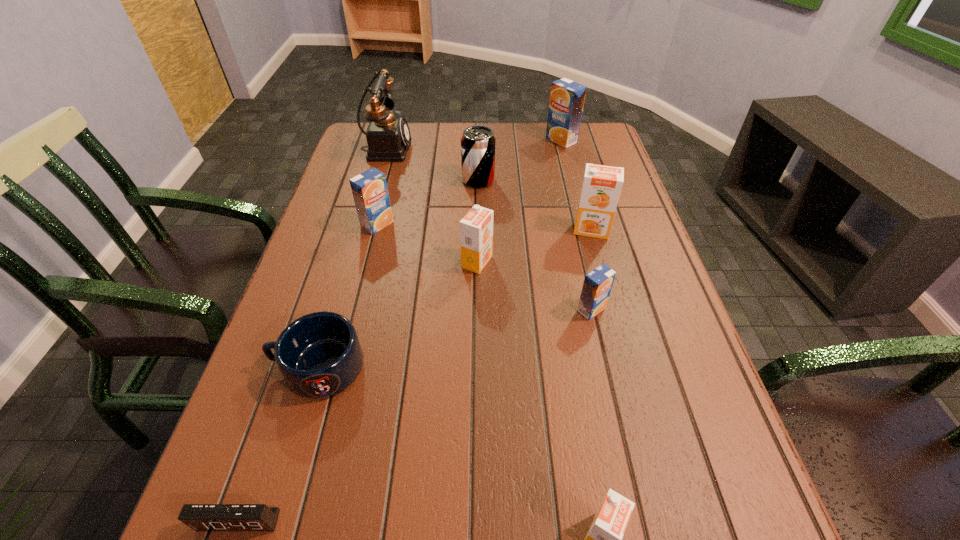
This screenshot has width=960, height=540. Find the location of `object present at the far right corner`. object present at the far right corner is located at coordinates (567, 97).

Where is `free space at the far edge of the desktop`? The width and height of the screenshot is (960, 540). free space at the far edge of the desktop is located at coordinates (540, 150).

You are a GUI agent. You are given a task and a screenshot of the screen. Output one action in this format:
    pyautogui.click(x=<x>, y=<y>)
    Task: Click on the vacant space at the left edge
    This screenshot has width=960, height=540.
    Given the screenshot: What is the action you would take?
    pyautogui.click(x=351, y=265)

Identify the location of vacant space at the right edge of the desktop. (585, 165).

You are a GUI agent. You are given a task and a screenshot of the screen. Output one action in this format:
    pyautogui.click(x=<x>, y=<y>)
    Task: Click on the free space between the second shortest object and the biggest blue orange_juice
    This screenshot has height=540, width=960.
    Given the screenshot: What is the action you would take?
    pyautogui.click(x=440, y=254)

You are a GUI agent. You are given a task and a screenshot of the screen. Output one action in this format:
    pyautogui.click(x=<x>, y=<y>)
    Task: Click on the free space between the ninth tallest object and the soda can
    
    Given the screenshot: What is the action you would take?
    pyautogui.click(x=398, y=274)

What are the coordinates of `vacant region between the shortest object and the mug` in the screenshot? It's located at point(278,444).

The image size is (960, 540). Identify the location of vacant area that lies between the eighth nearest object and the biggest orange orange juice. (535, 205).

At what (x,y) coordinates should I click in order to perform the action: click on object that ranks as the second closest to the shortest object. Please return your answer as a coordinate pair (x, y). Looking at the image, I should click on (604, 538).

Locate which object ranks eighth in proximity to the soda can. Please provide its 2D coordinates. Your answer should be formatted as a tuple, i.e. [(x, y)], where the tuple contains the x and y coordinates of a point satisfying the conditions above.

[(604, 538)]